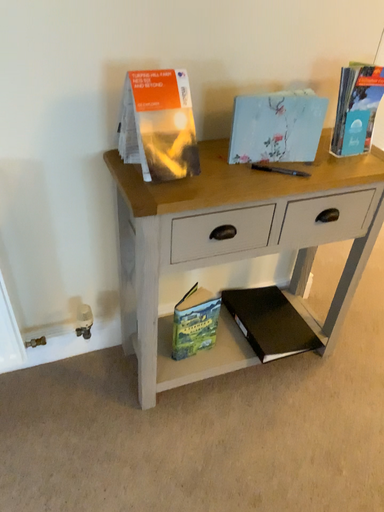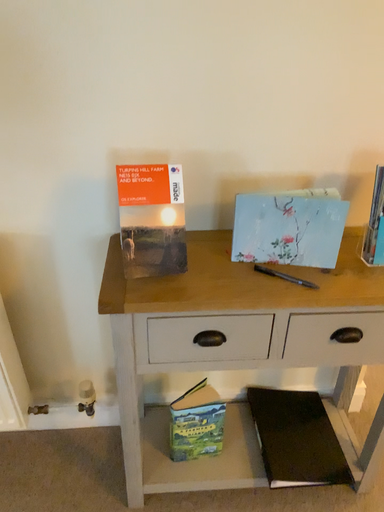
Question: How did the camera likely rotate when shooting the video?

Choices:
 (A) rotated left
 (B) rotated right

Answer: (A)